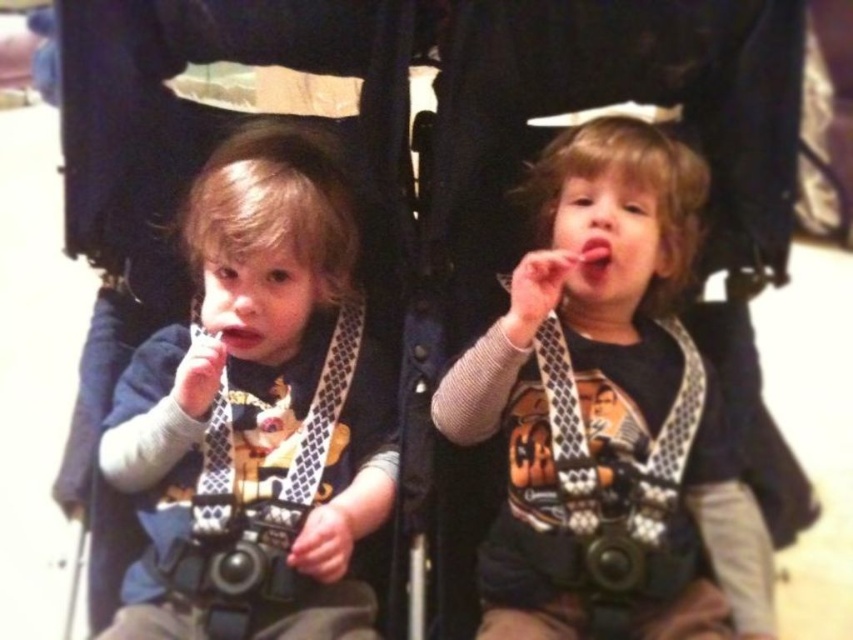
What is the position of the matte black shirt at center in the image?

The matte black shirt at center is located at point coordinates of (605, 406).

You are a photographer taking a picture of the two children in the stroller. You notice a point at coordinates (605, 406) in the image. What object is located at that point?

The point at coordinates (605, 406) marks the matte black shirt at center.